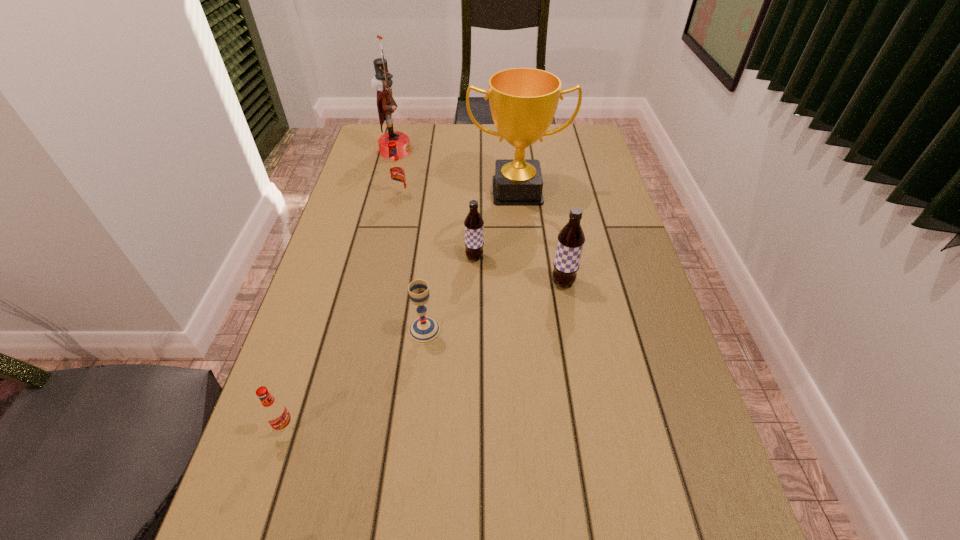
Find the location of a particular element. Image resolution: width=960 pixels, height=540 pixels. object at the far edge is located at coordinates (382, 82).

You are a GUI agent. You are given a task and a screenshot of the screen. Output one action in this format:
    pyautogui.click(x=<x>, y=<y>)
    Task: Click on the nutcracker at the left edge
    
    Given the screenshot: What is the action you would take?
    pyautogui.click(x=382, y=82)

Where is `object that is at the right edge`? The width and height of the screenshot is (960, 540). object that is at the right edge is located at coordinates (523, 101).

Find the location of `object that is positioned at the far left corner`. object that is positioned at the far left corner is located at coordinates (382, 82).

This screenshot has height=540, width=960. Find the location of `vacant space at the left edge of the desktop`. vacant space at the left edge of the desktop is located at coordinates (334, 325).

Where is `blank area at the right edge`? This screenshot has height=540, width=960. blank area at the right edge is located at coordinates (591, 296).

At what (x,y) coordinates should I click in order to perform the action: click on vacant space at the far right corner of the desktop. Please return your answer as a coordinate pair (x, y). Looking at the image, I should click on (557, 148).

Where is `empty location between the farther red root beer and the third root beer from left to right`? The image size is (960, 540). empty location between the farther red root beer and the third root beer from left to right is located at coordinates (437, 227).

You are a GUI agent. You are given a task and a screenshot of the screen. Output one action in this format:
    pyautogui.click(x=<x>, y=<y>)
    Task: Click on the vacant area that lies between the farther brown root beer and the second nearest object
    Image resolution: width=960 pixels, height=540 pixels.
    Given the screenshot: What is the action you would take?
    pyautogui.click(x=449, y=294)

This screenshot has width=960, height=540. Find the location of `free point between the fourth farthest object and the smaller red root beer`. free point between the fourth farthest object and the smaller red root beer is located at coordinates (380, 342).